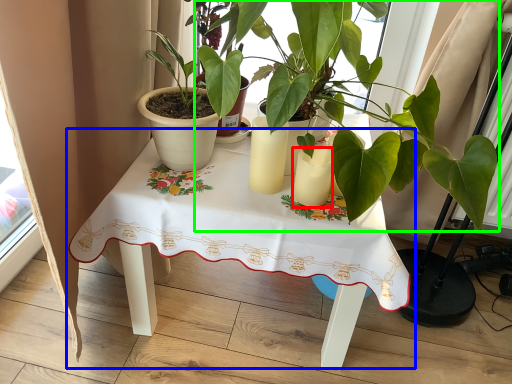
Question: Which object is the farthest from candle holder (highlighted by a red box)? Choose among these: table (highlighted by a blue box) or houseplant (highlighted by a green box).

Choices:
 (A) table
 (B) houseplant

Answer: (A)